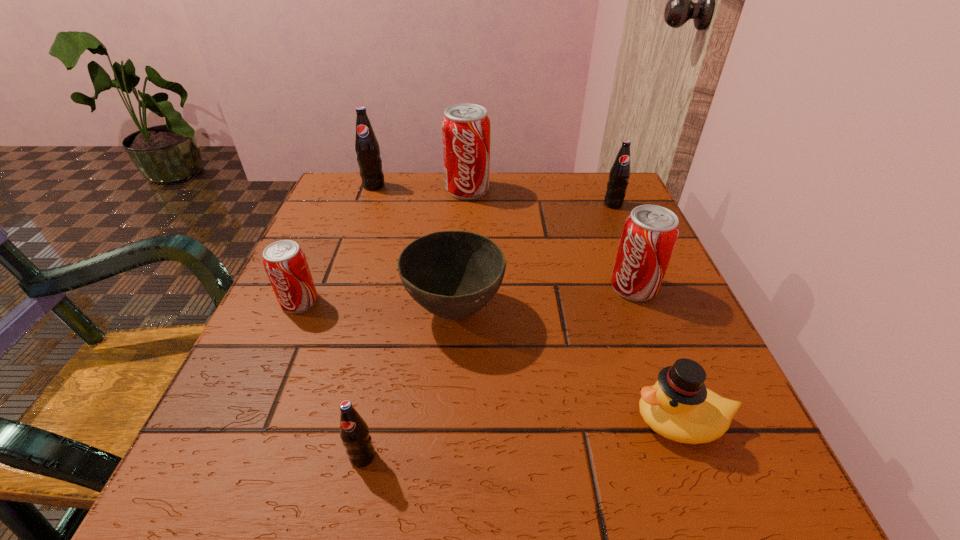
Where is `vacant space situated on the front-facing side of the duck`? Image resolution: width=960 pixels, height=540 pixels. vacant space situated on the front-facing side of the duck is located at coordinates (421, 421).

Locate an element on the screen. This screenshot has height=540, width=960. pop present at the near edge is located at coordinates (354, 432).

You are a GUI agent. You are given a task and a screenshot of the screen. Output one action in this format:
    pyautogui.click(x=<x>, y=<y>)
    Task: Click on the duck present at the near edge
    The height and width of the screenshot is (540, 960).
    Given the screenshot: What is the action you would take?
    pyautogui.click(x=679, y=407)

The width and height of the screenshot is (960, 540). I want to click on duck located in the right edge section of the desktop, so click(x=679, y=407).

You are a GUI agent. You are given a task and a screenshot of the screen. Output one action in this format:
    pyautogui.click(x=<x>, y=<y>)
    Task: Click on the object present at the far left corner
    The image size is (960, 540).
    Given the screenshot: What is the action you would take?
    pyautogui.click(x=367, y=148)

The image size is (960, 540). Identify the location of object located at the far right corner. (619, 175).

Locate an element on the screen. Image resolution: width=960 pixels, height=540 pixels. object situated at the near right corner is located at coordinates (679, 407).

At what (x,y) coordinates should I click in order to perform the action: click on free space at the far edge. Please return your answer as a coordinate pair (x, y). Looking at the image, I should click on (504, 204).

At what (x,y) coordinates should I click in order to perform the action: click on free space at the left edge of the desktop. Please return your answer as a coordinate pair (x, y). This screenshot has width=960, height=540. Looking at the image, I should click on (328, 232).

Find the location of a particular element. vacant point at the right edge is located at coordinates coord(612,236).